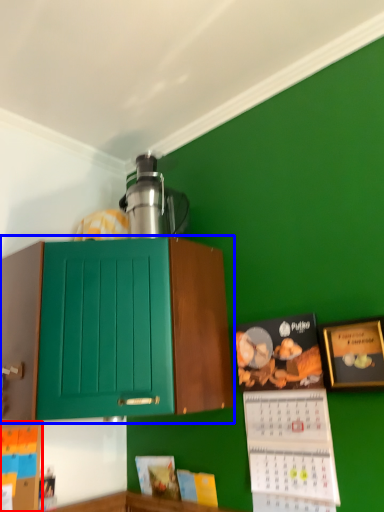
Question: Which point is further to the camera, book (highlighted by a red box) or cabinetry (highlighted by a blue box)?

Choices:
 (A) book
 (B) cabinetry

Answer: (A)